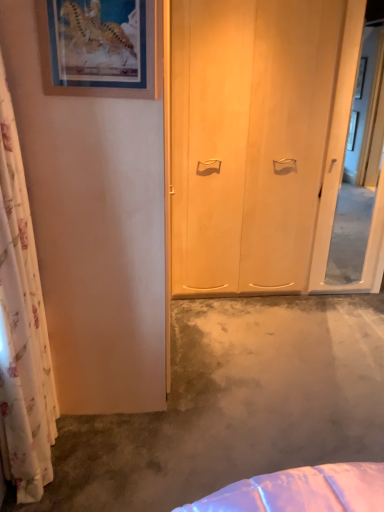
Describe the element at coordinates (97, 50) in the screenshot. The height and width of the screenshot is (512, 384). I see `wooden picture frame at upper left` at that location.

You are a GUI agent. You are given a task and a screenshot of the screen. Output one action in this format:
    pyautogui.click(x=<x>, y=<y>)
    Task: Click on the white floral curtain at left
    This screenshot has height=512, width=384.
    Given the screenshot: What is the action you would take?
    pyautogui.click(x=22, y=328)

The image size is (384, 512). What are the coordinates of `wooden picture frame at upper left` in the screenshot? It's located at (97, 50).

Does white floral curtain at left have a lesser width compared to concreteroughconcrete at center?

Yes, white floral curtain at left is thinner than concreteroughconcrete at center.

From the image's perspective, which is above, white floral curtain at left or concreteroughconcrete at center?

white floral curtain at left, from the image's perspective.

From the image's perspective, who appears lower, transparent glass screen door at right or wooden picture frame at upper left?

transparent glass screen door at right is shown below in the image.

Considering the sizes of transparent glass screen door at right and wooden picture frame at upper left in the image, is transparent glass screen door at right wider or thinner than wooden picture frame at upper left?

Clearly, transparent glass screen door at right has less width compared to wooden picture frame at upper left.

This screenshot has height=512, width=384. I want to click on screen door below the wooden picture frame at upper left (from the image's perspective), so click(353, 170).

Consider the image. Is transparent glass screen door at right to the right of wooden picture frame at upper left from the viewer's perspective?

Yes, transparent glass screen door at right is to the right of wooden picture frame at upper left.

Considering the sizes of objects transparent glass screen door at right and concreteroughconcrete at center in the image provided, who is smaller, transparent glass screen door at right or concreteroughconcrete at center?

Smaller between the two is transparent glass screen door at right.

Considering the sizes of objects transparent glass screen door at right and concreteroughconcrete at center in the image provided, who is shorter, transparent glass screen door at right or concreteroughconcrete at center?

Standing shorter between the two is concreteroughconcrete at center.

Locate an element on the screen. screen door that appears above the concreteroughconcrete at center (from the image's perspective) is located at coordinates (353, 170).

Is transparent glass screen door at right wider or thinner than concreteroughconcrete at center?

Considering their sizes, transparent glass screen door at right looks slimmer than concreteroughconcrete at center.

From a real-world perspective, who is located lower, wooden picture frame at upper left or concreteroughconcrete at center?

In real-world perspective, concreteroughconcrete at center is lower.

Is point (154, 87) positioned behind point (197, 423)?

No, it is not.

Is wooden picture frame at upper left not near concreteroughconcrete at center?

wooden picture frame at upper left is far away from concreteroughconcrete at center.

Locate an element on the screen. The image size is (384, 512). screen door above the concreteroughconcrete at center (from a real-world perspective) is located at coordinates (353, 170).

In the image, is concreteroughconcrete at center on the left side or the right side of transparent glass screen door at right?

concreteroughconcrete at center is to the left of transparent glass screen door at right.

How different are the orientations of concreteroughconcrete at center and transparent glass screen door at right in degrees?

There is a 180-degree angle between the facing directions of concreteroughconcrete at center and transparent glass screen door at right.

Consider the image. Is concreteroughconcrete at center directly adjacent to transparent glass screen door at right?

No, concreteroughconcrete at center is not next to transparent glass screen door at right.

Between concreteroughconcrete at center and wooden picture frame at upper left, which one appears on the left side from the viewer's perspective?

Positioned to the left is wooden picture frame at upper left.

This screenshot has height=512, width=384. I want to click on picture frame located on the left of concreteroughconcrete at center, so click(x=97, y=50).

Is concreteroughconcrete at center positioned far away from wooden picture frame at upper left?

Indeed, concreteroughconcrete at center is not near wooden picture frame at upper left.

Is concreteroughconcrete at center taller than wooden picture frame at upper left?

Incorrect, the height of concreteroughconcrete at center is not larger of that of wooden picture frame at upper left.

Looking at this image, from a real-world perspective, is wooden picture frame at upper left located higher than transparent glass screen door at right?

Indeed, from a real-world perspective, wooden picture frame at upper left stands above transparent glass screen door at right.

Is the surface of wooden picture frame at upper left in direct contact with transparent glass screen door at right?

No, wooden picture frame at upper left is not touching transparent glass screen door at right.

In terms of width, does wooden picture frame at upper left look wider or thinner when compared to transparent glass screen door at right?

Clearly, wooden picture frame at upper left has more width compared to transparent glass screen door at right.

Locate an element on the screen. The height and width of the screenshot is (512, 384). picture frame in front of the transparent glass screen door at right is located at coordinates (97, 50).

Where is `curtain located above the concreteroughconcrete at center (from the image's perspective)`? curtain located above the concreteroughconcrete at center (from the image's perspective) is located at coordinates (22, 328).

Locate an element on the screen. screen door behind the wooden picture frame at upper left is located at coordinates pyautogui.click(x=353, y=170).

Which object lies further to the anchor point white floral curtain at left, transparent glass screen door at right or concreteroughconcrete at center?

transparent glass screen door at right lies further to white floral curtain at left than the other object.

When comparing their distances from wooden picture frame at upper left, does white floral curtain at left or concreteroughconcrete at center seem further?

concreteroughconcrete at center is positioned further to the anchor wooden picture frame at upper left.

Based on their spatial positions, is wooden picture frame at upper left or transparent glass screen door at right further from white floral curtain at left?

The object further to white floral curtain at left is transparent glass screen door at right.

When comparing their distances from concreteroughconcrete at center, does white floral curtain at left or wooden picture frame at upper left seem closer?

The object closer to concreteroughconcrete at center is white floral curtain at left.

From the image, which object appears to be farther from transparent glass screen door at right, white floral curtain at left or concreteroughconcrete at center?

white floral curtain at left.

When comparing their distances from concreteroughconcrete at center, does wooden picture frame at upper left or transparent glass screen door at right seem further?

The object further to concreteroughconcrete at center is transparent glass screen door at right.

Estimate the real-world distances between objects in this image. Which object is further from wooden picture frame at upper left, transparent glass screen door at right or white floral curtain at left?

The object further to wooden picture frame at upper left is transparent glass screen door at right.

Looking at the image, which one is located further to transparent glass screen door at right, white floral curtain at left or wooden picture frame at upper left?

white floral curtain at left.

Locate an element on the screen. Image resolution: width=384 pixels, height=512 pixels. curtain between wooden picture frame at upper left and concreteroughconcrete at center from top to bottom is located at coordinates (22, 328).

Image resolution: width=384 pixels, height=512 pixels. What are the coordinates of `picture frame between white floral curtain at left and transparent glass screen door at right in the horizontal direction` in the screenshot? It's located at (x=97, y=50).

At what (x,y) coordinates should I click in order to perform the action: click on concrete between white floral curtain at left and transparent glass screen door at right from left to right. Please return your answer as a coordinate pair (x, y). The width and height of the screenshot is (384, 512). Looking at the image, I should click on (234, 405).

You are a GUI agent. You are given a task and a screenshot of the screen. Output one action in this format:
    pyautogui.click(x=<x>, y=<y>)
    Task: Click on the concrete between wooden picture frame at upper left and transparent glass screen door at right from left to right
    The image size is (384, 512).
    Given the screenshot: What is the action you would take?
    pyautogui.click(x=234, y=405)